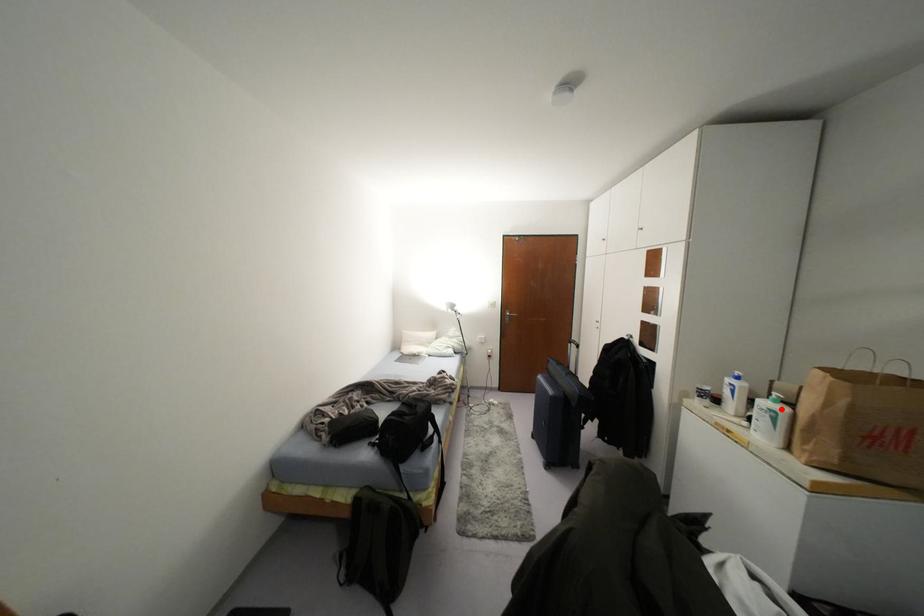
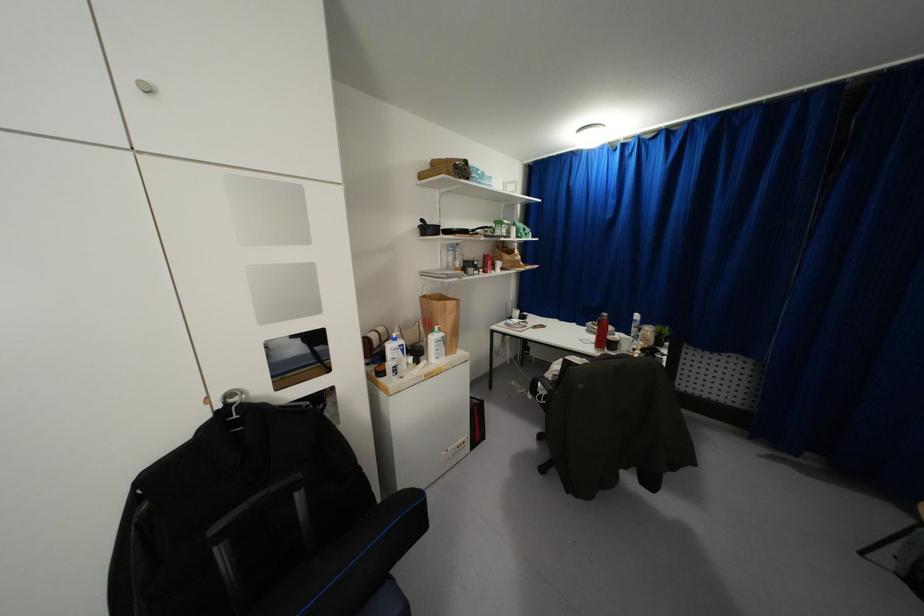
Where in the second image is the point corresponding to the highlighted location from the first image?

(442, 333)